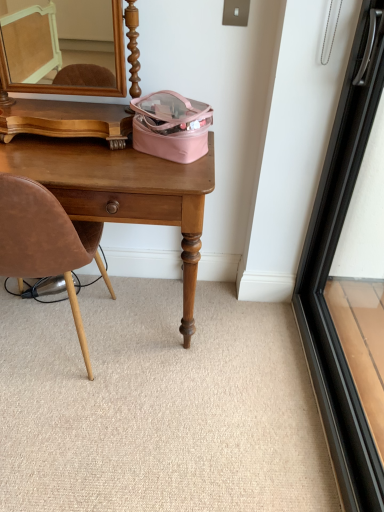
You are a GUI agent. You are given a task and a screenshot of the screen. Output one action in this format:
    pyautogui.click(x=<x>, y=<y>)
    Task: Click on the free space above beige carpet at lower center (from a real-world perspective)
    
    Given the screenshot: What is the action you would take?
    pyautogui.click(x=145, y=369)